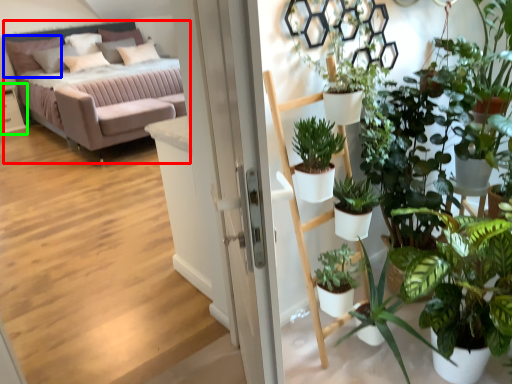
Question: Considering the real-world distances, which object is closest to studio couch (highlighted by a red box)? pillow (highlighted by a blue box) or table (highlighted by a green box).

Choices:
 (A) pillow
 (B) table

Answer: (A)